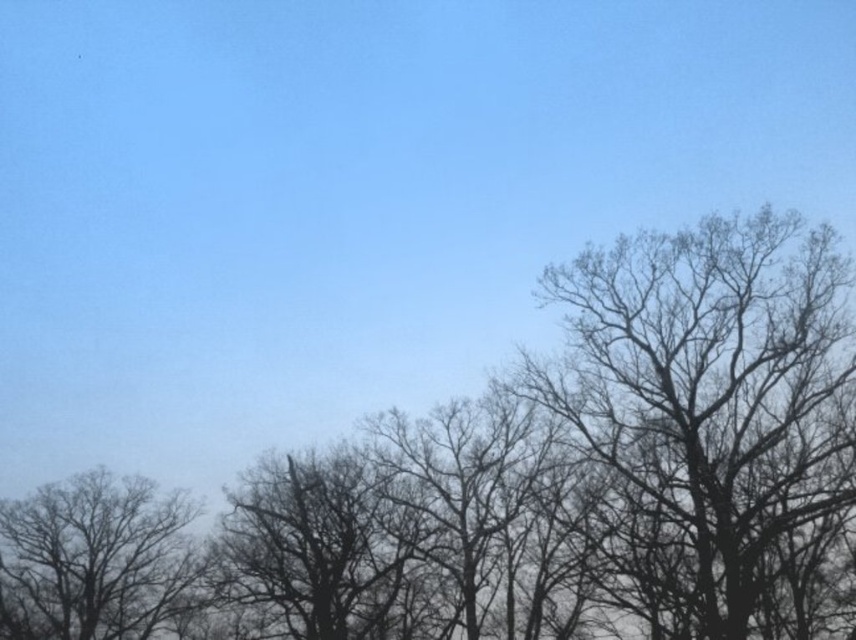
Question: Does bare branches at right appear under silhouette bare tree at left?

Choices:
 (A) yes
 (B) no

Answer: (B)

Question: Can you confirm if bare branches at right is bigger than silhouette bare tree at left?

Choices:
 (A) no
 (B) yes

Answer: (B)

Question: Among these objects, which one is farthest from the camera?

Choices:
 (A) bare branches at right
 (B) silhouette bare tree at left

Answer: (B)

Question: Observing the image, what is the correct spatial positioning of bare branches at right in reference to silhouette bare tree at left?

Choices:
 (A) right
 (B) left

Answer: (A)